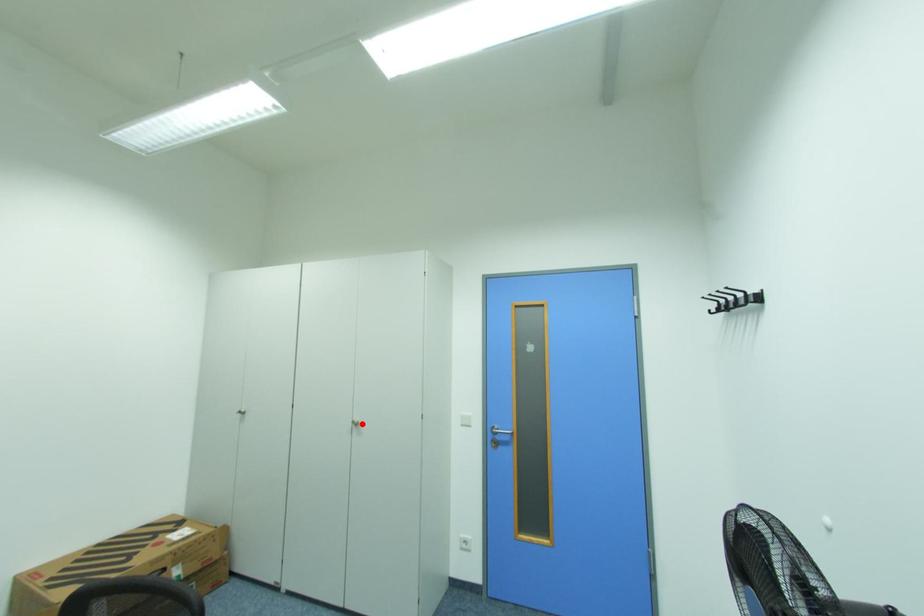
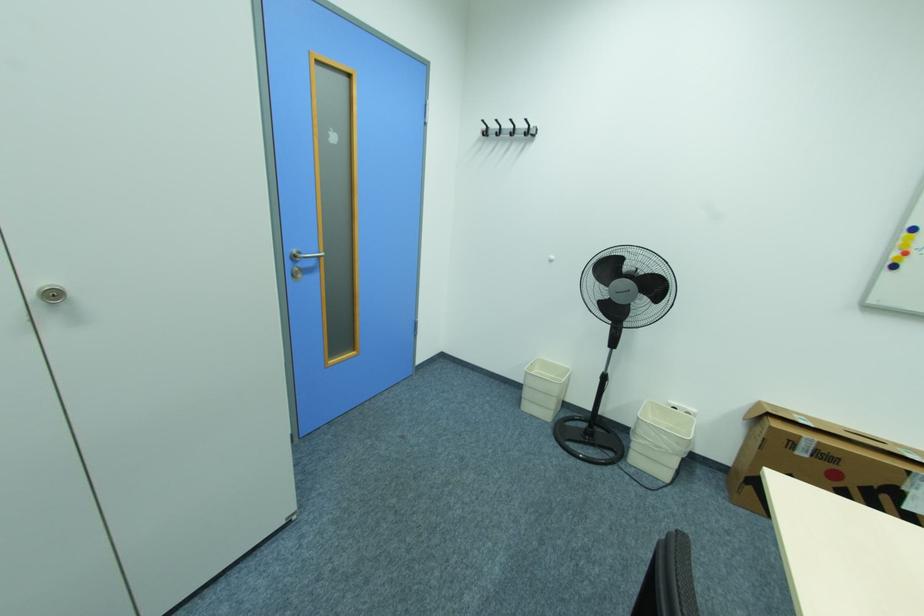
In the second image, find the point that corresponds to the highlighted location in the first image.

(64, 294)